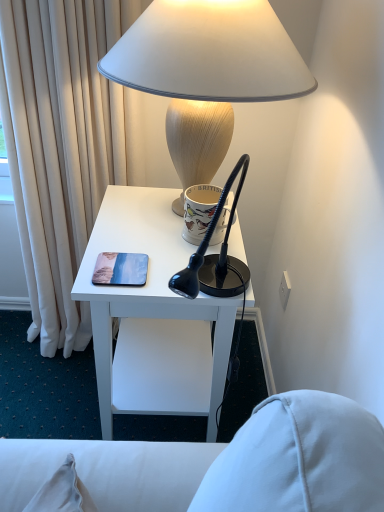
Question: Is white matte lampshade at upper center positioned before white ceramic mug at upper center?

Choices:
 (A) yes
 (B) no

Answer: (A)

Question: Does white matte lampshade at upper center lie behind white ceramic mug at upper center?

Choices:
 (A) no
 (B) yes

Answer: (A)

Question: Can you confirm if white matte lampshade at upper center is smaller than white ceramic mug at upper center?

Choices:
 (A) no
 (B) yes

Answer: (A)

Question: Can we say white matte lampshade at upper center lies outside white ceramic mug at upper center?

Choices:
 (A) yes
 (B) no

Answer: (A)

Question: Can you confirm if white matte lampshade at upper center is positioned to the left of white ceramic mug at upper center?

Choices:
 (A) yes
 (B) no

Answer: (A)

Question: Is white matte lampshade at upper center oriented towards white ceramic mug at upper center?

Choices:
 (A) yes
 (B) no

Answer: (B)

Question: Is white ceramic mug at upper center turned away from white matte lampshade at upper center?

Choices:
 (A) yes
 (B) no

Answer: (A)

Question: Is the position of white ceramic mug at upper center more distant than that of white matte lampshade at upper center?

Choices:
 (A) yes
 (B) no

Answer: (A)

Question: Is white ceramic mug at upper center far away from white matte lampshade at upper center?

Choices:
 (A) no
 (B) yes

Answer: (A)

Question: Is white ceramic mug at upper center to the right of white matte lampshade at upper center from the viewer's perspective?

Choices:
 (A) no
 (B) yes

Answer: (B)

Question: From the image's perspective, is white ceramic mug at upper center on top of white matte lampshade at upper center?

Choices:
 (A) yes
 (B) no

Answer: (B)

Question: Considering the relative sizes of white ceramic mug at upper center and white matte lampshade at upper center in the image provided, is white ceramic mug at upper center shorter than white matte lampshade at upper center?

Choices:
 (A) yes
 (B) no

Answer: (A)

Question: Is white glossy desk at center shorter than white matte lampshade at upper center?

Choices:
 (A) yes
 (B) no

Answer: (B)